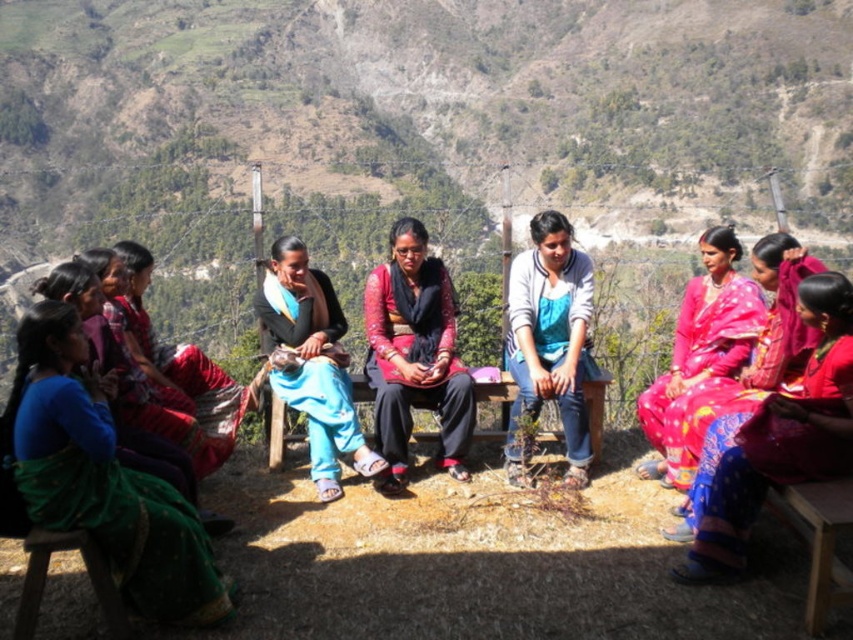
You are a photographer trying to capture a closeup shot of the floral silk saree at center and the wooden bench at center. Given that your camera can focus on objects up to 5 meters away, will you be able to get both in focus at the same time?

The floral silk saree at center and wooden bench at center are 7.00 meters apart. Since the camera can only focus up to 5 meters, it won cannot capture both in focus simultaneously.

You are a photographer trying to capture a clear shot of both the green silk saree at left and the matte black pants at center. Since you can only focus on one subject at a time, which one should you focus on to ensure the other appears in the background?

You should focus on the green silk saree at left because it is in front of the matte black pants at center, so the pants will be in the background when the saree is in focus.

You are a photographer standing at the center of the scene. You want to capture a closeup of the green silk saree at left. Which direction should you move to get closer to it?

The green silk saree at left is located at point (102, 477), so you should move to the left to get closer to it.